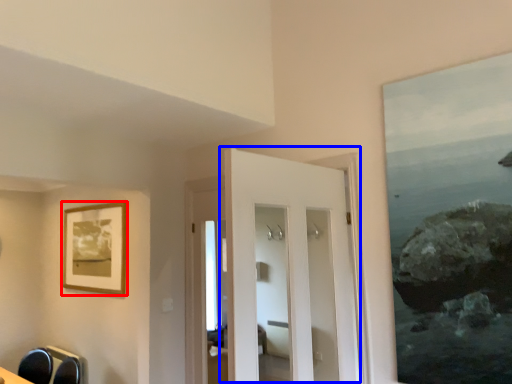
Question: Which object appears closest to the camera in this image, picture frame (highlighted by a red box) or door (highlighted by a blue box)?

Choices:
 (A) picture frame
 (B) door

Answer: (B)